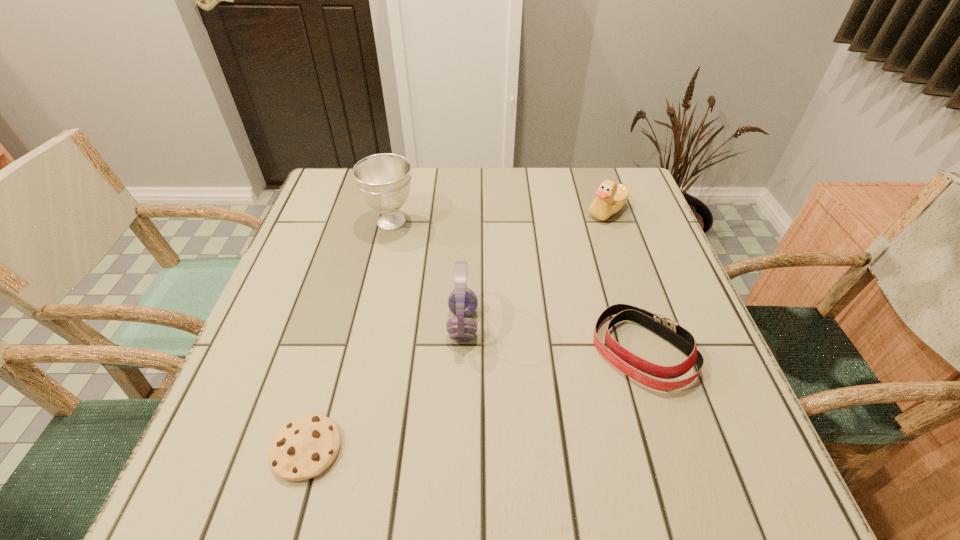
Locate an element on the screen. This screenshot has width=960, height=540. vacant space located 0.220m at the beak of the duck is located at coordinates (505, 212).

Locate an element on the screen. This screenshot has width=960, height=540. free spot located on the left of the dog collar is located at coordinates (463, 351).

Find the location of a particular element. The image size is (960, 540). free point located on the right of the nearest object is located at coordinates (498, 449).

The width and height of the screenshot is (960, 540). What are the coordinates of `chalice present at the far edge` in the screenshot? It's located at (384, 180).

Locate an element on the screen. Image resolution: width=960 pixels, height=540 pixels. duck at the far edge is located at coordinates (611, 197).

Where is `object located at the near edge`? The image size is (960, 540). object located at the near edge is located at coordinates (305, 447).

I want to click on chalice located in the left edge section of the desktop, so click(384, 180).

The image size is (960, 540). I want to click on cookie present at the left edge, so click(305, 447).

Locate an element on the screen. duck positioned at the right edge is located at coordinates (611, 197).

Locate an element on the screen. The height and width of the screenshot is (540, 960). dog collar that is positioned at the right edge is located at coordinates (668, 329).